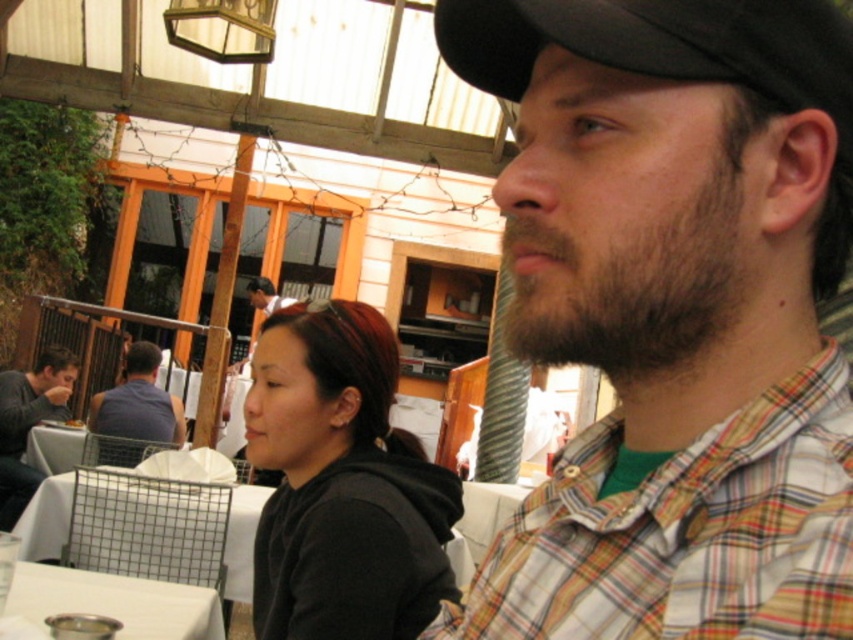
Question: Is black hoodie at center behind matte gray sweater at left?

Choices:
 (A) yes
 (B) no

Answer: (B)

Question: Estimate the real-world distances between objects in this image. Which object is farther from the white plastic table at lower left?

Choices:
 (A) dark blue shirt at left
 (B) matte gray sweater at left

Answer: (A)

Question: Which of the following is the farthest from the observer?

Choices:
 (A) (270, 292)
 (B) (28, 394)
 (C) (688, 58)

Answer: (A)

Question: Where is black hoodie at center located in relation to matte gray sweater at left in the image?

Choices:
 (A) above
 (B) below

Answer: (A)

Question: Is plaid shirt at center positioned before plaid cotton shirt at right?

Choices:
 (A) yes
 (B) no

Answer: (B)

Question: Which point is closer to the camera taking this photo?

Choices:
 (A) (67, 429)
 (B) (508, 3)
 (C) (663, 534)

Answer: (C)